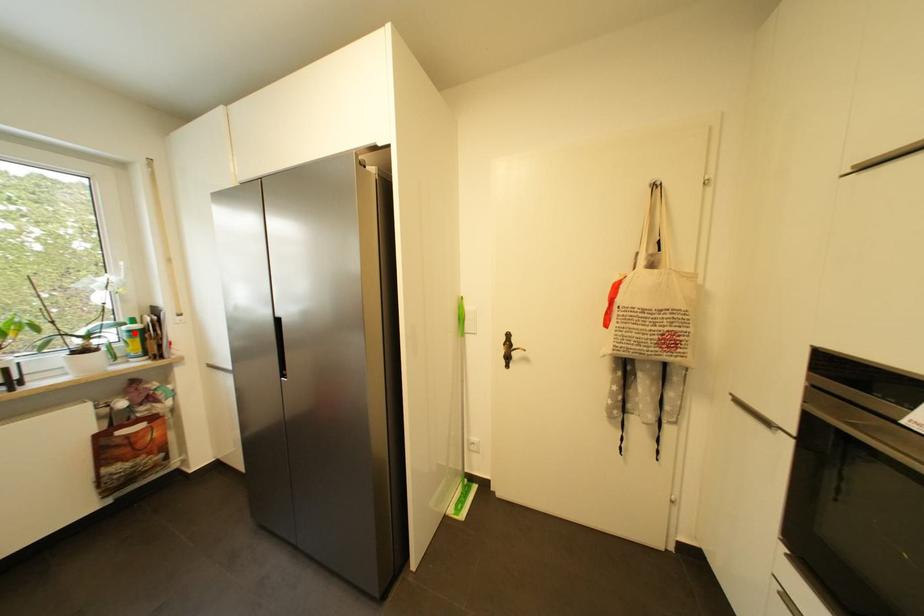
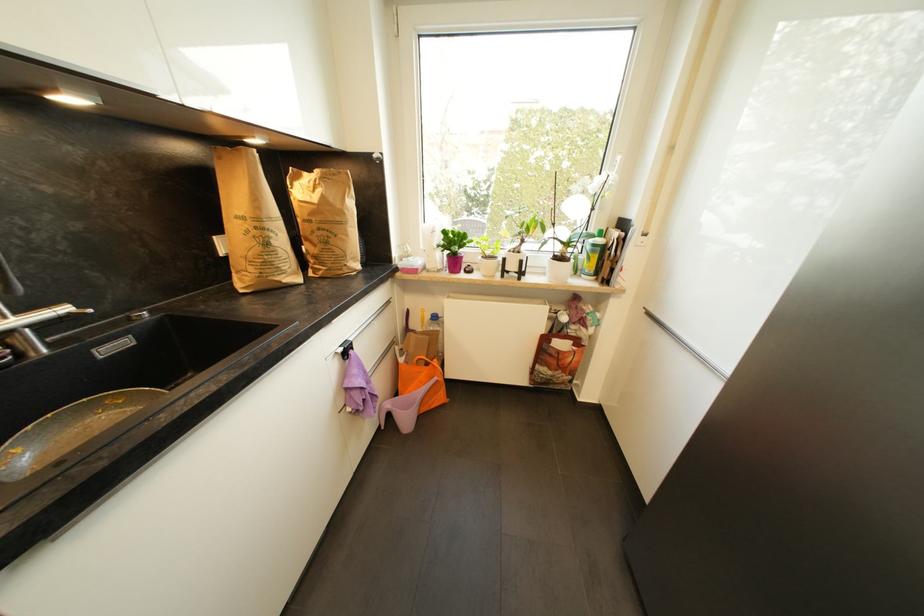
In the second image, find the point that corresponds to the highlighted location in the first image.

(599, 246)